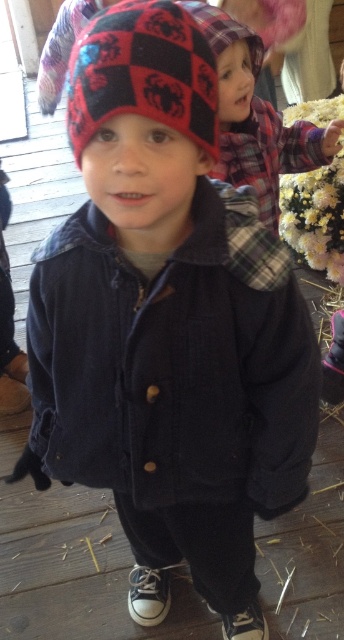
Between point (155, 408) and point (184, 4), which one is positioned behind?

Point (184, 4)

In order to click on navy corduroy jacket at center in this screenshot , I will do `click(175, 362)`.

Is point (135, 376) farther from viewer compared to point (228, 106)?

No, (135, 376) is in front of (228, 106).

Where is `navy corduroy jacket at center`? navy corduroy jacket at center is located at coordinates (175, 362).

Is the position of red checkered knit beanie at upper left less distant than that of plaid fabric child at upper center?

Yes, red checkered knit beanie at upper left is closer to the viewer.

The width and height of the screenshot is (344, 640). What do you see at coordinates (143, 74) in the screenshot?
I see `red checkered knit beanie at upper left` at bounding box center [143, 74].

This screenshot has width=344, height=640. Describe the element at coordinates (143, 74) in the screenshot. I see `red checkered knit beanie at upper left` at that location.

Locate an element on the screen. red checkered knit beanie at upper left is located at coordinates (143, 74).

Between navy corduroy jacket at center and red checkered knit beanie at upper left, which one is positioned higher?

red checkered knit beanie at upper left is above.

Does navy corduroy jacket at center have a lesser height compared to red checkered knit beanie at upper left?

In fact, navy corduroy jacket at center may be taller than red checkered knit beanie at upper left.

Locate an element on the screen. This screenshot has height=640, width=344. navy corduroy jacket at center is located at coordinates (175, 362).